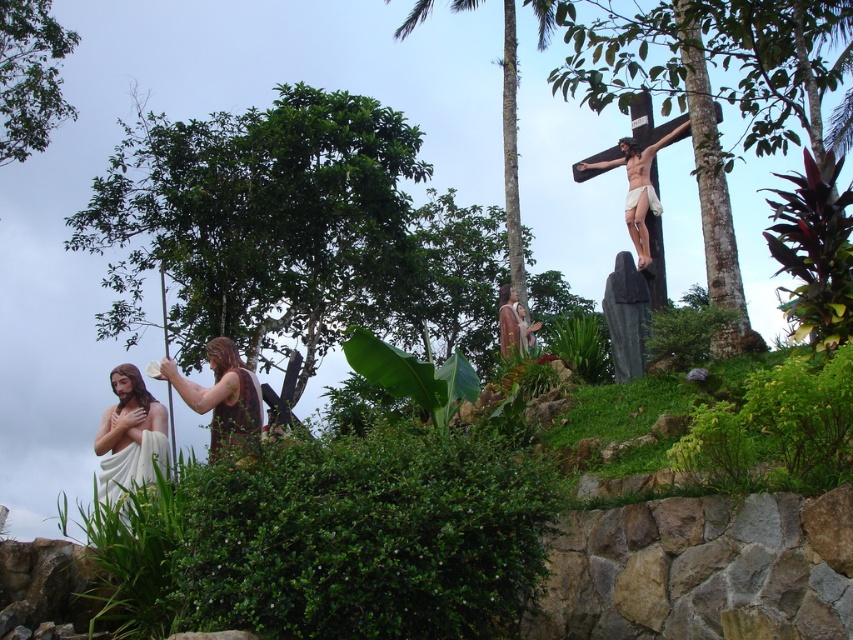
You are standing in front of the Stations of the Cross display. You notice two points marked in the scene. The first point is at coordinate point (x=318, y=285) and the second point is at coordinate point (x=131, y=394). Which point is closer to you?

Point (x=318, y=285) is further to the camera than point (x=131, y=394), so the point closer to you is point (x=131, y=394).

You are an artist planning to paint this religious scene. You need to decide the placement of the green leafy tree at left and the white marble statue at lower left in your painting. Based on the scene description, which object should you draw taller?

The green leafy tree at left should be drawn taller than the white marble statue at lower left because the green leafy tree at left has a greater height compared to the white marble statue at lower left according to the description.

You are standing at the base of the stone wall in the religious scene. You want to place a small bouquet of flowers exactly at the point marked as point (x=718, y=88). Which object in the scene is located at that coordinate?

The green leafy tree at center is located at point (x=718, y=88).